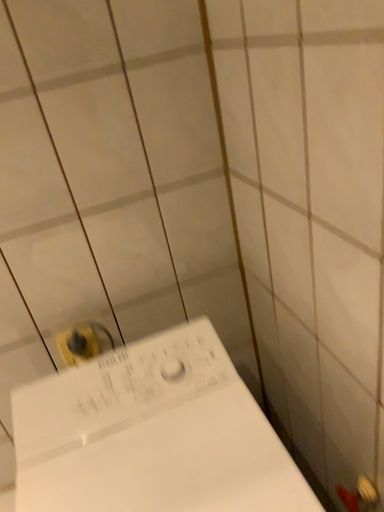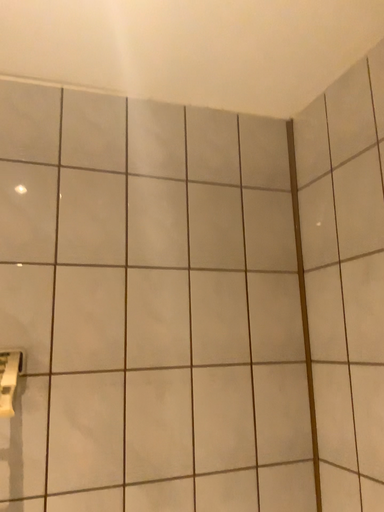
Question: How did the camera likely rotate when shooting the video?

Choices:
 (A) rotated downward
 (B) rotated upward

Answer: (B)